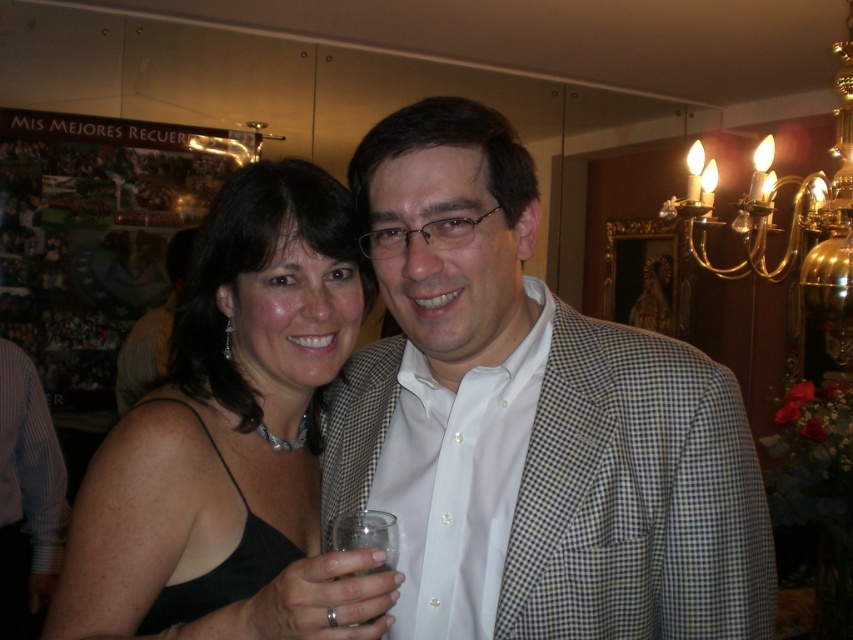
Question: Is blue striped shirt at left to the left of clear glass at lower center from the viewer's perspective?

Choices:
 (A) yes
 (B) no

Answer: (A)

Question: Is white checkered blazer at center thinner than matte black suit at center?

Choices:
 (A) no
 (B) yes

Answer: (A)

Question: Is the position of blue striped shirt at left more distant than that of clear glass at lower center?

Choices:
 (A) yes
 (B) no

Answer: (A)

Question: Which object appears farthest from the camera in this image?

Choices:
 (A) white checkered blazer at center
 (B) blue striped shirt at left
 (C) black satin dress at center

Answer: (B)

Question: Which object appears closest to the camera in this image?

Choices:
 (A) matte black suit at center
 (B) clear glass at lower center

Answer: (B)

Question: Which is farther from the clear glass at lower center?

Choices:
 (A) blue striped shirt at left
 (B) white checkered blazer at center
 (C) matte black suit at center
 (D) black satin dress at center

Answer: (C)